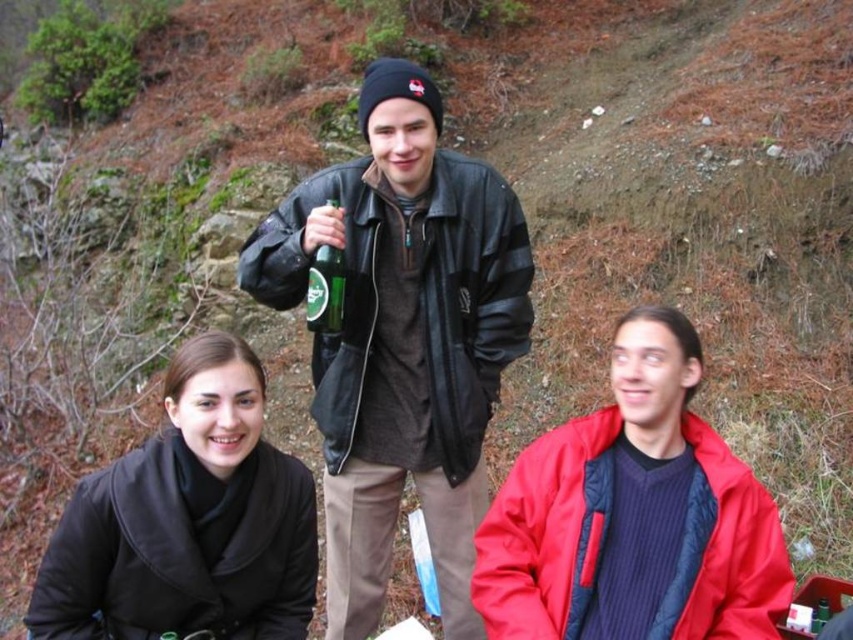
Is point (378, 145) positioned after point (628, 496)?

Yes.

This screenshot has height=640, width=853. What are the coordinates of `leather jacket at center` in the screenshot? It's located at (402, 339).

Who is taller, leather jacket at center or black matte coat at lower left?

leather jacket at center is taller.

Is leather jacket at center to the right of black matte coat at lower left from the viewer's perspective?

Correct, you'll find leather jacket at center to the right of black matte coat at lower left.

Which is in front, point (328, 541) or point (231, 506)?

Point (231, 506)

Identify the location of leather jacket at center. Image resolution: width=853 pixels, height=640 pixels. (402, 339).

Can you confirm if black matte coat at lower left is wider than green glass bottle at center?

Indeed, black matte coat at lower left has a greater width compared to green glass bottle at center.

Can you confirm if black matte coat at lower left is thinner than green glass bottle at center?

In fact, black matte coat at lower left might be wider than green glass bottle at center.

Identify the location of black matte coat at lower left. The height and width of the screenshot is (640, 853). (189, 522).